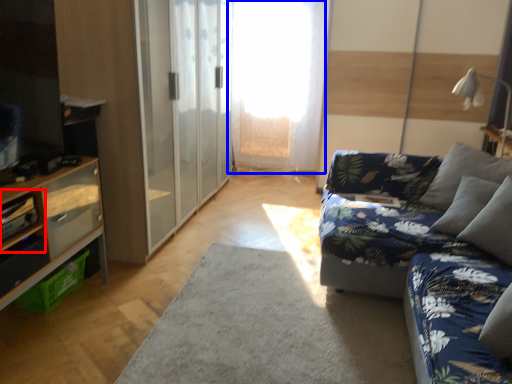
Question: Which object appears closest to the camera in this image, shelf (highlighted by a red box) or window screen (highlighted by a blue box)?

Choices:
 (A) shelf
 (B) window screen

Answer: (A)